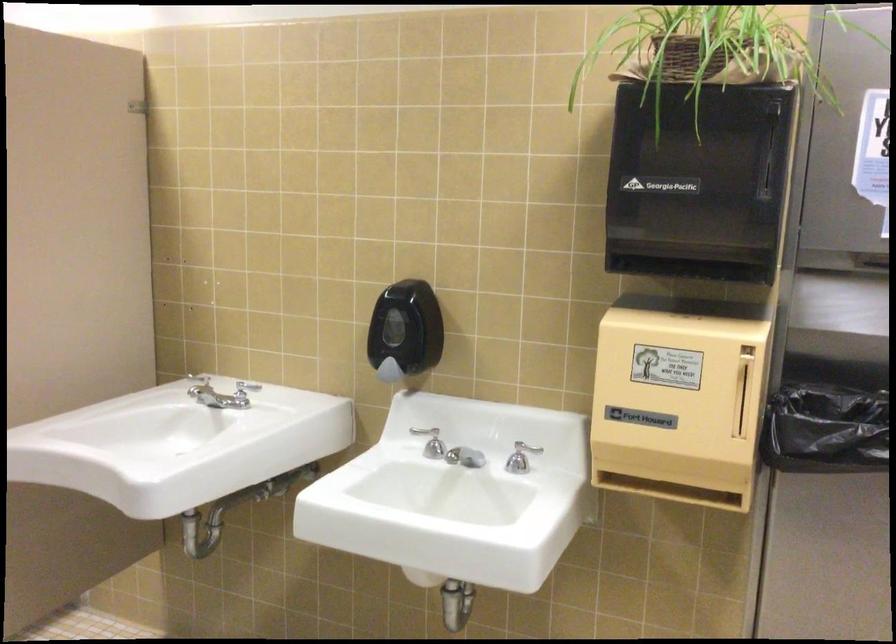
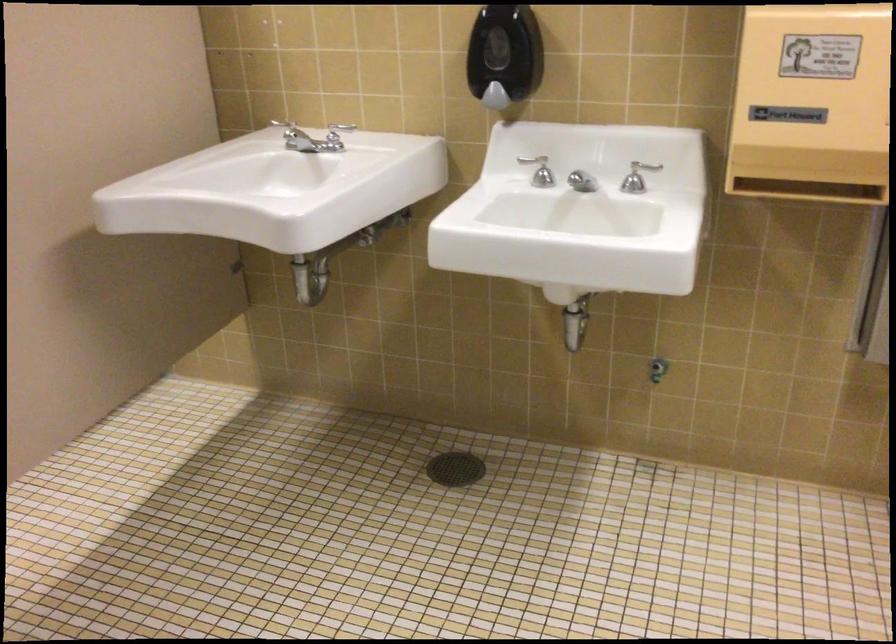
Question: Based on the continuous images, in which direction is the camera rotating? Reply with the corresponding letter.

Choices:
 (A) Left
 (B) Right
 (C) Up
 (D) Down

Answer: (D)